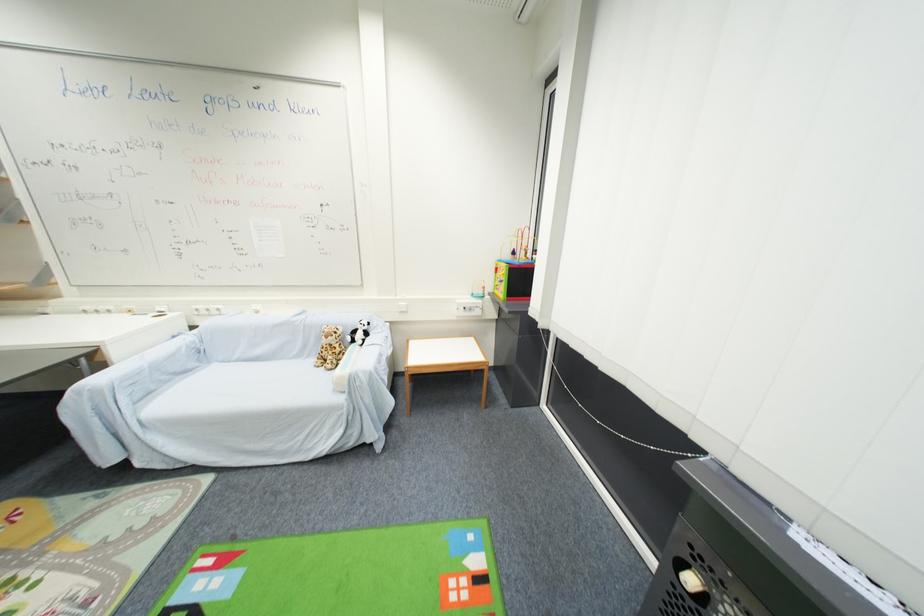
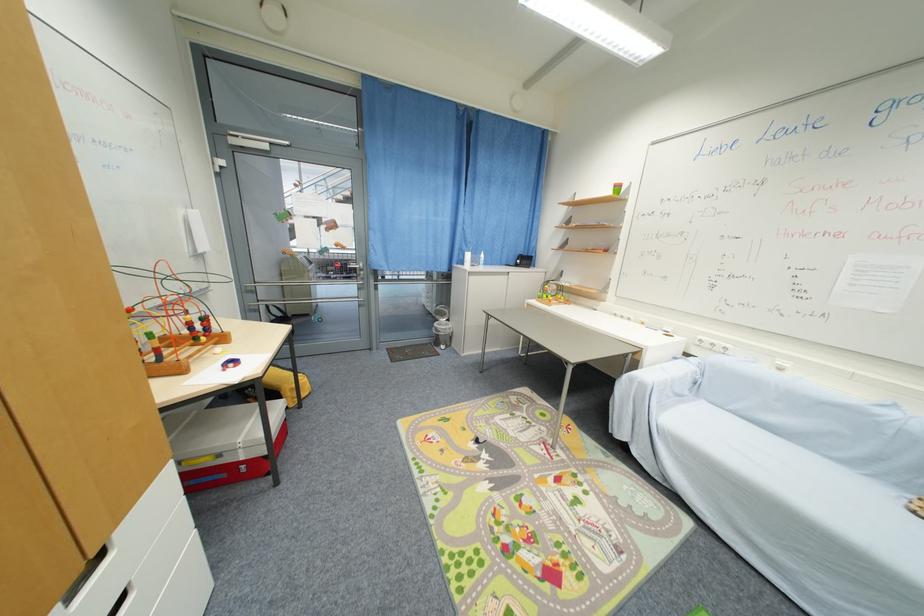
The point at [220,314] is marked in the first image. Where is the corresponding point in the second image?

(723, 351)